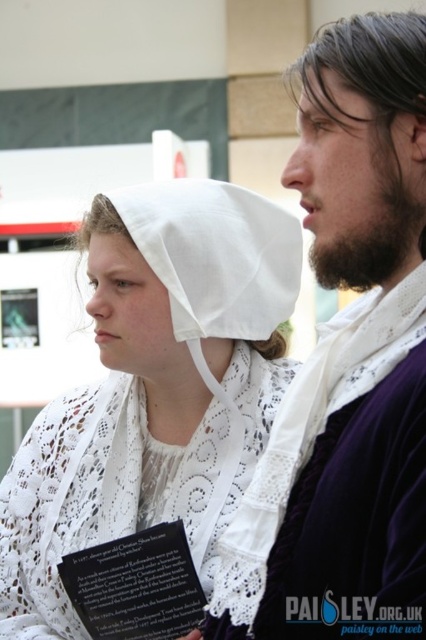
Who is taller, white lace bonnet at center or black paper at lower left?

white lace bonnet at center is taller.

Which is above, white lace bonnet at center or black paper at lower left?

white lace bonnet at center

Image resolution: width=426 pixels, height=640 pixels. Describe the element at coordinates (155, 388) in the screenshot. I see `white lace bonnet at center` at that location.

The width and height of the screenshot is (426, 640). In order to click on white lace bonnet at center in this screenshot , I will do `click(155, 388)`.

Is velvet purple robe at center bigger than white cotton bonnet at center?

Yes, velvet purple robe at center is bigger than white cotton bonnet at center.

From the picture: Can you confirm if velvet purple robe at center is taller than white cotton bonnet at center?

Correct, velvet purple robe at center is much taller as white cotton bonnet at center.

Find the location of a particular element. The width and height of the screenshot is (426, 640). velvet purple robe at center is located at coordinates (347, 365).

Does white lace bonnet at center have a greater height compared to white cotton bonnet at center?

Yes.

Is white lace bonnet at center bigger than white cotton bonnet at center?

Indeed, white lace bonnet at center has a larger size compared to white cotton bonnet at center.

Is point (279, 380) farther from viewer compared to point (163, 236)?

That is True.

Locate an element on the screen. This screenshot has height=640, width=426. white lace bonnet at center is located at coordinates (155, 388).